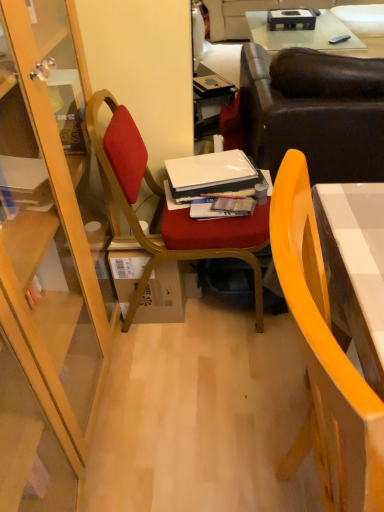
From the picture: What is the approximate width of matte paper magazine at center?

It is 4.68 inches.

The width and height of the screenshot is (384, 512). What are the coordinates of `matte paper magazine at center` in the screenshot? It's located at (221, 207).

Measure the distance between matte yellow chair at right, arranged as the 2th chair when viewed from the back, and camera.

matte yellow chair at right, arranged as the 2th chair when viewed from the back, and camera are 11.14 inches apart from each other.

Image resolution: width=384 pixels, height=512 pixels. What do you see at coordinates (258, 10) in the screenshot?
I see `leather couch at upper center` at bounding box center [258, 10].

This screenshot has width=384, height=512. What are the coordinates of `matte wood chair at center, the 1th chair viewed from the back` in the screenshot? It's located at (166, 208).

Could you tell me if brown cardboard box at center is turned towards matte paper magazine at center?

No.

Considering the relative sizes of brown cardboard box at center and matte paper magazine at center in the image provided, is brown cardboard box at center taller than matte paper magazine at center?

Indeed, brown cardboard box at center has a greater height compared to matte paper magazine at center.

Which object is further away from the camera taking this photo, brown cardboard box at center or matte paper magazine at center?

brown cardboard box at center is behind.

Is matte paper magazine at center turned away from brown cardboard box at center?

No.

In the scene shown: Would you say matte paper magazine at center is to the left or to the right of brown cardboard box at center in the picture?

In the image, matte paper magazine at center appears on the right side of brown cardboard box at center.

In the scene shown: Is matte paper magazine at center placed right next to brown cardboard box at center?

matte paper magazine at center is not next to brown cardboard box at center, and they're not touching.

Would you say brown cardboard box at center is part of matte paper magazine at center's contents?

No.

Can you confirm if leather couch at upper center is smaller than matte paper magazine at center?

No, leather couch at upper center is not smaller than matte paper magazine at center.

Is leather couch at upper center next to matte paper magazine at center?

They are not placed beside each other.

You are a GUI agent. You are given a task and a screenshot of the screen. Output one action in this format:
    pyautogui.click(x=<x>, y=<y>)
    Task: Click on the magazine located below the leather couch at upper center (from the image's perspective)
    Image resolution: width=384 pixels, height=512 pixels.
    Given the screenshot: What is the action you would take?
    pyautogui.click(x=221, y=207)

From the image's perspective, is leather couch at upper center located above or below matte paper magazine at center?

Clearly, from the image's perspective, leather couch at upper center is above matte paper magazine at center.

Is brown cardboard box at center in front of or behind leather couch at upper center in the image?

Clearly, brown cardboard box at center is in front of leather couch at upper center.

Is brown cardboard box at center beside leather couch at upper center?

There is a gap between brown cardboard box at center and leather couch at upper center.

From the image's perspective, is brown cardboard box at center under leather couch at upper center?

Indeed, from the image's perspective, brown cardboard box at center is shown beneath leather couch at upper center.

How many degrees apart are the facing directions of brown cardboard box at center and leather couch at upper center?

1.06 degrees.

Identify the location of studio couch located above the matte wood chair at center, the 1th chair viewed from the back (from the image's perspective). click(314, 112).

Is matte wood chair at center, which appears as the 2th chair when viewed from the front, wider or thinner than leather couch at upper right?

matte wood chair at center, which appears as the 2th chair when viewed from the front, is thinner than leather couch at upper right.

Looking at this image, considering the relative positions of matte wood chair at center, which appears as the 2th chair when viewed from the front, and leather couch at upper right in the image provided, is matte wood chair at center, which appears as the 2th chair when viewed from the front, in front of leather couch at upper right?

Yes, it is in front of leather couch at upper right.

From the image's perspective, is matte wood chair at center, the 1th chair viewed from the back, located beneath leather couch at upper right?

Indeed, from the image's perspective, matte wood chair at center, the 1th chair viewed from the back, is shown beneath leather couch at upper right.

Does matte wood chair at center, the 1th chair viewed from the back, have a greater height compared to brown cardboard box at center?

Yes, matte wood chair at center, the 1th chair viewed from the back, is taller than brown cardboard box at center.

From a real-world perspective, relative to brown cardboard box at center, is matte wood chair at center, which appears as the 2th chair when viewed from the front, vertically above or below?

matte wood chair at center, which appears as the 2th chair when viewed from the front, is situated higher than brown cardboard box at center in the real world.

Considering the points (106, 152) and (156, 283), which point is in front, point (106, 152) or point (156, 283)?

The point (106, 152) is more forward.

Are matte wood chair at center, the 1th chair viewed from the back, and brown cardboard box at center far apart?

matte wood chair at center, the 1th chair viewed from the back, is near brown cardboard box at center, not far away.

From the image's perspective, is leather couch at upper right above brown cardboard box at center?

Correct, leather couch at upper right appears higher than brown cardboard box at center in the image.

Can you confirm if leather couch at upper right is shorter than brown cardboard box at center?

In fact, leather couch at upper right may be taller than brown cardboard box at center.

Is leather couch at upper right placed right next to brown cardboard box at center?

There is a gap between leather couch at upper right and brown cardboard box at center.

Does leather couch at upper right appear on the left side of brown cardboard box at center?

Incorrect, leather couch at upper right is not on the left side of brown cardboard box at center.

In the image, there is a brown cardboard box at center. Identify the location of magazine above it (from the image's perspective). The height and width of the screenshot is (512, 384). (221, 207).

Find the location of a particular element. Image resolution: width=384 pixels, height=512 pixels. box on the left of matte paper magazine at center is located at coordinates (162, 296).

When comparing their distances from matte yellow chair at right, arranged as the 2th chair when viewed from the back, does matte wood chair at center, the 1th chair viewed from the back, or leather couch at upper center seem closer?

matte wood chair at center, the 1th chair viewed from the back, lies closer to matte yellow chair at right, arranged as the 2th chair when viewed from the back, than the other object.

Which object lies further to the anchor point matte yellow chair at right, the first chair in the front-to-back sequence, leather couch at upper center or brown cardboard box at center?

leather couch at upper center is positioned further to the anchor matte yellow chair at right, the first chair in the front-to-back sequence.

Estimate the real-world distances between objects in this image. Which object is closer to leather couch at upper right, matte yellow chair at right, arranged as the 2th chair when viewed from the back, or brown cardboard box at center?

The object closer to leather couch at upper right is brown cardboard box at center.

When comparing their distances from matte wood chair at center, which appears as the 2th chair when viewed from the front, does brown cardboard box at center or leather couch at upper right seem further?

leather couch at upper right.

Looking at the image, which one is located closer to matte yellow chair at right, the first chair in the front-to-back sequence, matte paper magazine at center or leather couch at upper right?

matte paper magazine at center lies closer to matte yellow chair at right, the first chair in the front-to-back sequence, than the other object.

In the scene shown: Considering their positions, is matte yellow chair at right, arranged as the 2th chair when viewed from the back, positioned closer to matte paper magazine at center than leather couch at upper right?

leather couch at upper right is closer to matte paper magazine at center.

Which object lies nearer to the anchor point brown cardboard box at center, leather couch at upper right or matte yellow chair at right, the first chair in the front-to-back sequence?

leather couch at upper right.

Estimate the real-world distances between objects in this image. Which object is closer to matte wood chair at center, the 1th chair viewed from the back, leather couch at upper center or matte yellow chair at right, arranged as the 2th chair when viewed from the back?

Among the two, matte yellow chair at right, arranged as the 2th chair when viewed from the back, is located nearer to matte wood chair at center, the 1th chair viewed from the back.

Where is `box positioned between leather couch at upper right and leather couch at upper center from near to far`? box positioned between leather couch at upper right and leather couch at upper center from near to far is located at coordinates (162, 296).

Locate an element on the screen. This screenshot has height=512, width=384. box positioned between matte yellow chair at right, the first chair in the front-to-back sequence, and leather couch at upper center from near to far is located at coordinates (162, 296).

Identify the location of magazine between leather couch at upper right and leather couch at upper center from front to back. (221, 207).

Where is `magazine positioned between matte yellow chair at right, arranged as the 2th chair when viewed from the back, and leather couch at upper center from near to far`? magazine positioned between matte yellow chair at right, arranged as the 2th chair when viewed from the back, and leather couch at upper center from near to far is located at coordinates (221, 207).